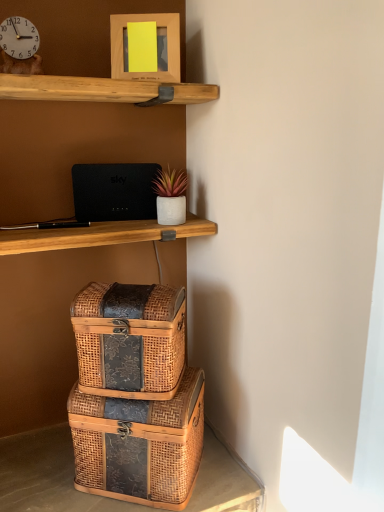
This screenshot has height=512, width=384. I want to click on vacant area located to the right-hand side of woven wood box at center, the first box when ordered from bottom to top, so click(219, 471).